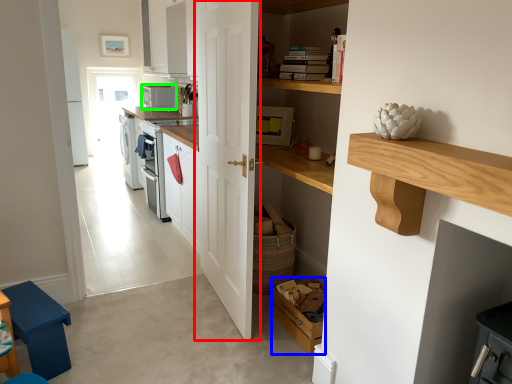
Question: Estimate the real-world distances between objects in this image. Which object is closer to door (highlighted by a red box), box (highlighted by a blue box) or appliance (highlighted by a green box)?

Choices:
 (A) box
 (B) appliance

Answer: (A)